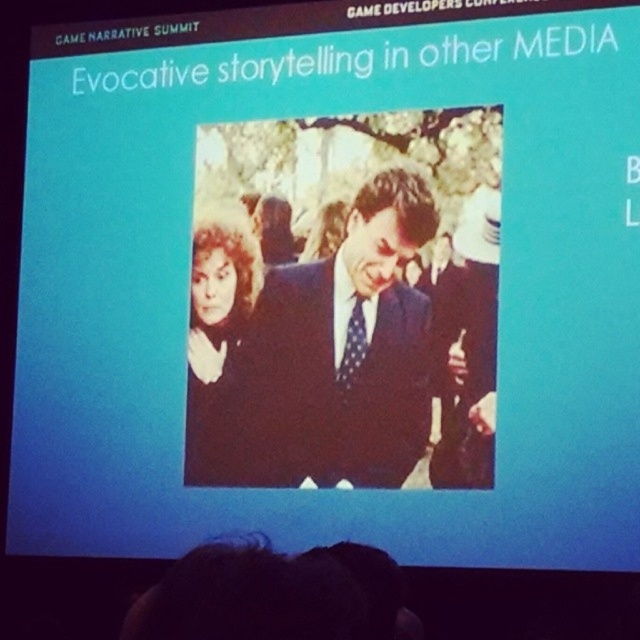
Between dark blue suit at center and matte black coat at center, which one appears on the left side from the viewer's perspective?

Positioned to the left is matte black coat at center.

Which is behind, point (417, 244) or point (202, 458)?

The point (202, 458) is behind.

Find the location of `dark blue suit at center`. dark blue suit at center is located at coordinates (344, 352).